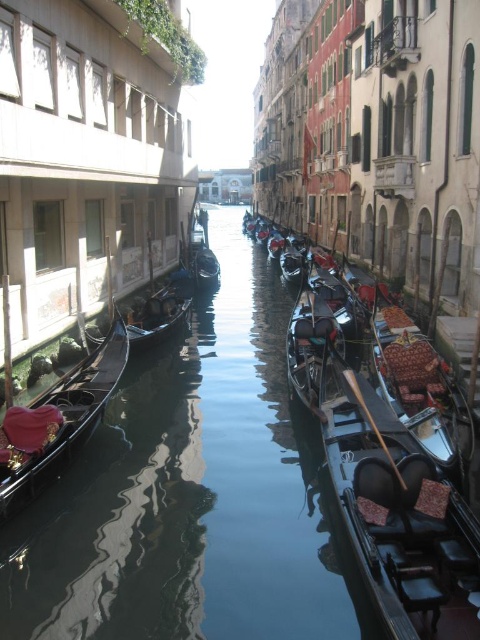
In the scene shown: Can you confirm if shiny black gondola at left is wider than wooden gondola at center?

Correct, the width of shiny black gondola at left exceeds that of wooden gondola at center.

The height and width of the screenshot is (640, 480). What do you see at coordinates (63, 419) in the screenshot? I see `shiny black gondola at left` at bounding box center [63, 419].

What do you see at coordinates (63, 419) in the screenshot? The width and height of the screenshot is (480, 640). I see `shiny black gondola at left` at bounding box center [63, 419].

The width and height of the screenshot is (480, 640). Find the location of `shiny black gondola at left`. shiny black gondola at left is located at coordinates (63, 419).

Does polished wood gondola at center appear under wooden gondola at center?

Yes, polished wood gondola at center is below wooden gondola at center.

Which is above, polished wood gondola at center or wooden gondola at center?

A: Positioned higher is wooden gondola at center.

Which is in front, point (406, 404) or point (276, 250)?

Point (406, 404) is more forward.

Locate an element on the screen. The width and height of the screenshot is (480, 640). polished wood gondola at center is located at coordinates (420, 385).

Between point (41, 456) and point (201, 232), which one is positioned in front?

Point (41, 456)

How distant is shiny black gondola at left from shiny black gondola at center?

The distance of shiny black gondola at left from shiny black gondola at center is 35.55 meters.

Is point (79, 433) positioned in front of point (205, 212)?

Yes, point (79, 433) is closer to viewer.

Find the location of a particular element. shiny black gondola at left is located at coordinates (63, 419).